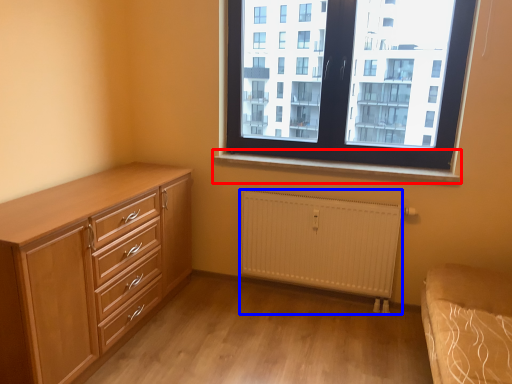
Question: Among these objects, which one is nearest to the camera, window sill (highlighted by a red box) or radiator (highlighted by a blue box)?

Choices:
 (A) window sill
 (B) radiator

Answer: (A)